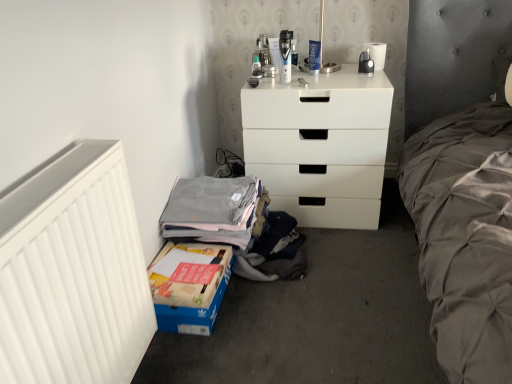
Question: Looking at their shapes, would you say matte plastic shaver at upper center is wider or thinner than white matte chest of drawers at center?

Choices:
 (A) thin
 (B) wide

Answer: (A)

Question: Is matte plastic shaver at upper center taller or shorter than white matte chest of drawers at center?

Choices:
 (A) tall
 (B) short

Answer: (B)

Question: Considering the real-world distances, which object is farthest from the white matte radiator at left?

Choices:
 (A) gray cotton shirt at lower left
 (B) blue cardboard box at lower left
 (C) white matte chest of drawers at center
 (D) matte plastic shaver at upper center

Answer: (D)

Question: Estimate the real-world distances between objects in this image. Which object is farther from the matte plastic shaver at upper center?

Choices:
 (A) white matte radiator at left
 (B) gray cotton shirt at lower left
 (C) blue cardboard box at lower left
 (D) white matte chest of drawers at center

Answer: (A)